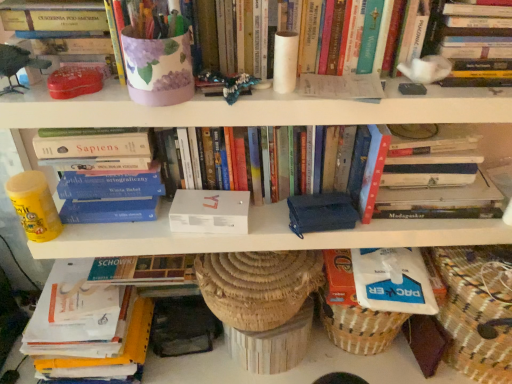
Question: Which is correct: white paper book at lower left, the 6th book viewed from the top, is inside matte purple vase at upper center, which ranks as the fifth book in bottom-to-top order, or outside of it?

Choices:
 (A) inside
 (B) outside

Answer: (B)

Question: Would you say white paper book at lower left, which is the 1th book in bottom-to-top order, is to the left or to the right of matte purple vase at upper center, which appears as the 2th book when viewed from the top, in the picture?

Choices:
 (A) left
 (B) right

Answer: (A)

Question: Which of these objects is positioned farthest from the matte purple vase at upper center, which ranks as the fifth book in bottom-to-top order?

Choices:
 (A) matte red box at upper left, positioned as the 4th book in bottom-to-top order
 (B) brown woven basket at lower right
 (C) hardcover book at left, the 5th book from the top
 (D) white matte box at center, the second paperback book when ordered from right to left
 (E) white matte box at center, which ranks as the third book in bottom-to-top order

Answer: (B)

Question: Which object is the closest to the matte plastic toy at left?

Choices:
 (A) matte purple vase at upper center, which ranks as the fifth book in bottom-to-top order
 (B) hardcover book at upper right, arranged as the 1th book when viewed from the top
 (C) white paper book at lower left, the 6th book viewed from the top
 (D) white matte box at center, the first paperback book from the left
 (E) white matte box at center, the fourth book from the top

Answer: (A)